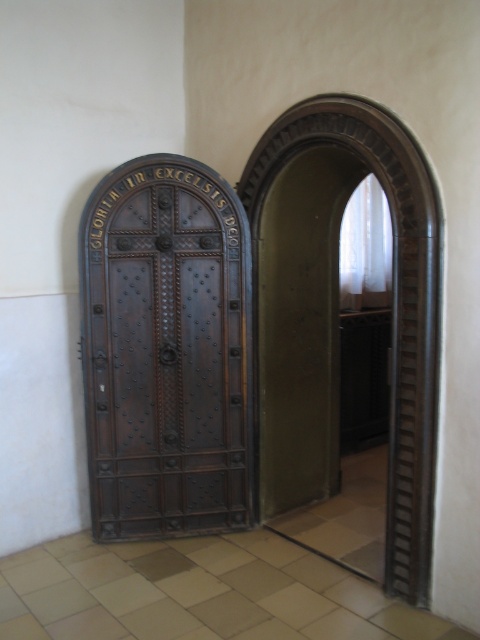
Question: Can you confirm if dark wood/embossed door at center is positioned above dark wood archway at center?

Choices:
 (A) yes
 (B) no

Answer: (B)

Question: Which point is closer to the camera taking this photo?

Choices:
 (A) (210, 234)
 (B) (424, 566)

Answer: (B)

Question: Does dark wood/embossed door at center appear under dark wood archway at center?

Choices:
 (A) yes
 (B) no

Answer: (A)

Question: Does dark wood/embossed door at center have a lesser width compared to dark wood archway at center?

Choices:
 (A) yes
 (B) no

Answer: (B)